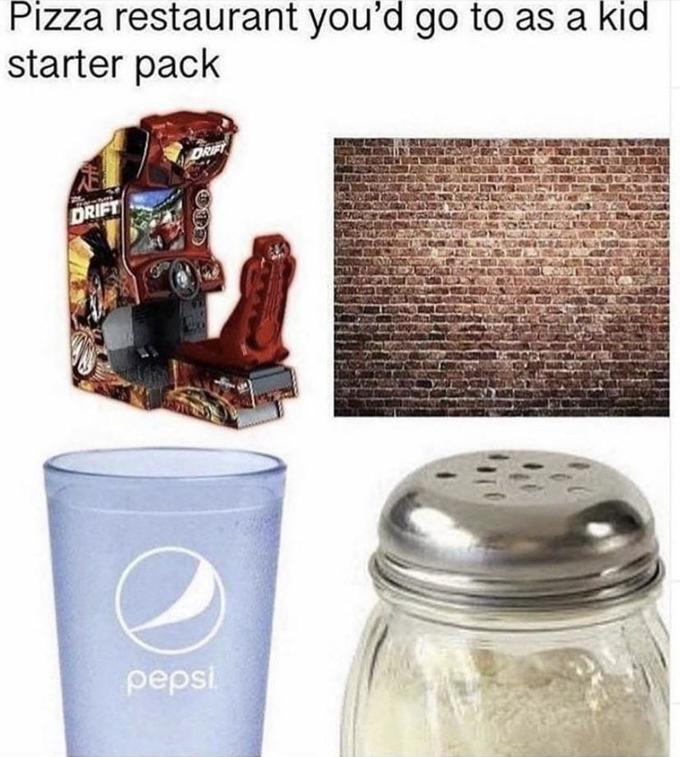
Locate an element on the screen. brick red wall is located at coordinates (508, 321).